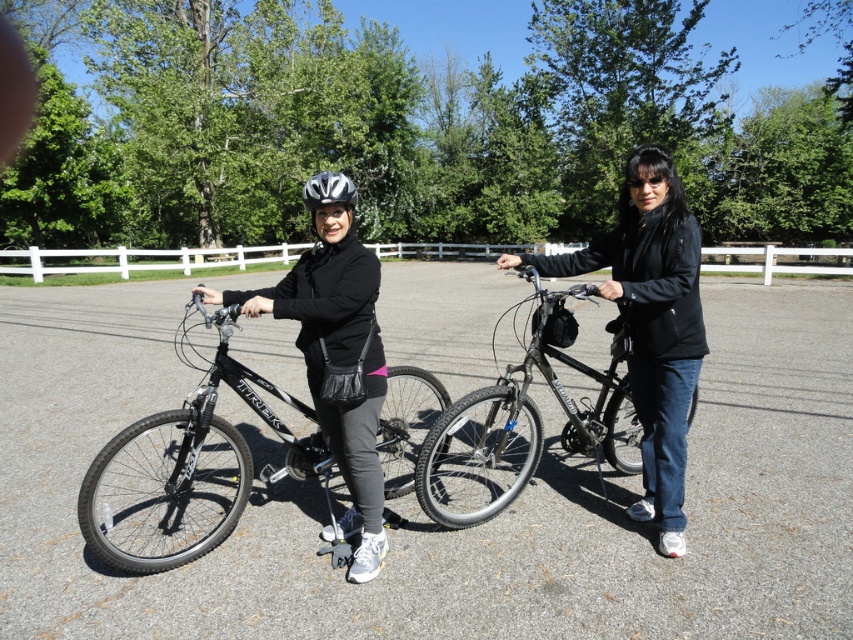
Does matte black bicycle at center have a greater height compared to matte black helmet at center?

Correct, matte black bicycle at center is much taller as matte black helmet at center.

Is matte black bicycle at center below matte black helmet at center?

Actually, matte black bicycle at center is above matte black helmet at center.

At what (x,y) coordinates should I click in order to perform the action: click on matte black bicycle at center. Please return your answer as a coordinate pair (x, y). Looking at the image, I should click on pos(610,353).

Locate an element on the screen. matte black bicycle at center is located at coordinates (610, 353).

How much distance is there between matte black bicycle at center and black matte bicycle at center?

matte black bicycle at center and black matte bicycle at center are 4.89 feet apart.

Is point (599, 284) closer to camera compared to point (165, 429)?

No, it is behind (165, 429).

Is point (564, 323) in front of point (136, 563)?

No.

At what (x,y) coordinates should I click in order to perform the action: click on matte black bicycle at center. Please return your answer as a coordinate pair (x, y). Looking at the image, I should click on (610, 353).

Does matte black bicycle at center have a smaller size compared to shiny black bicycle at center?

Incorrect, matte black bicycle at center is not smaller in size than shiny black bicycle at center.

Is matte black bicycle at center wider than shiny black bicycle at center?

Correct, the width of matte black bicycle at center exceeds that of shiny black bicycle at center.

At what (x,y) coordinates should I click in order to perform the action: click on matte black bicycle at center. Please return your answer as a coordinate pair (x, y). This screenshot has height=640, width=853. Looking at the image, I should click on (610, 353).

Locate an element on the screen. The image size is (853, 640). matte black bicycle at center is located at coordinates (610, 353).